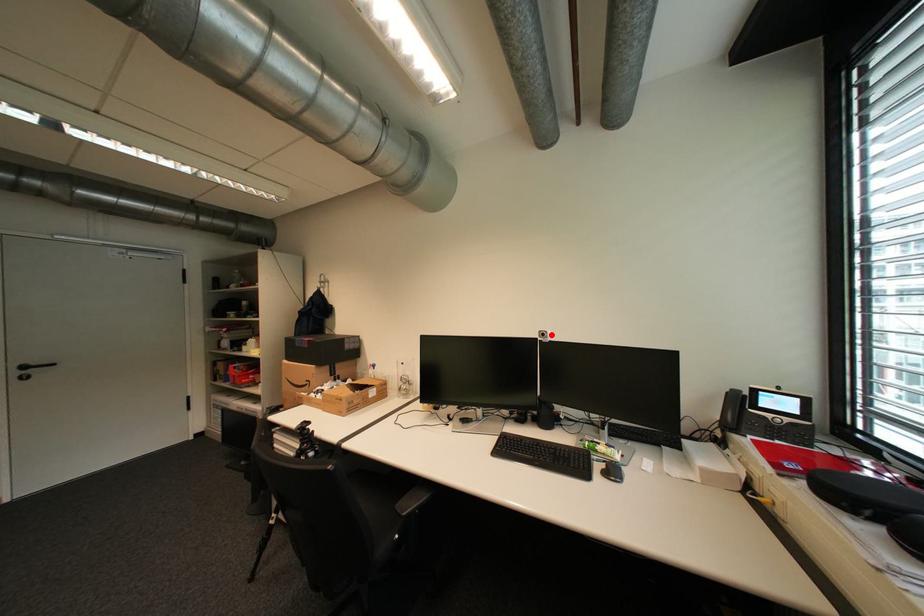
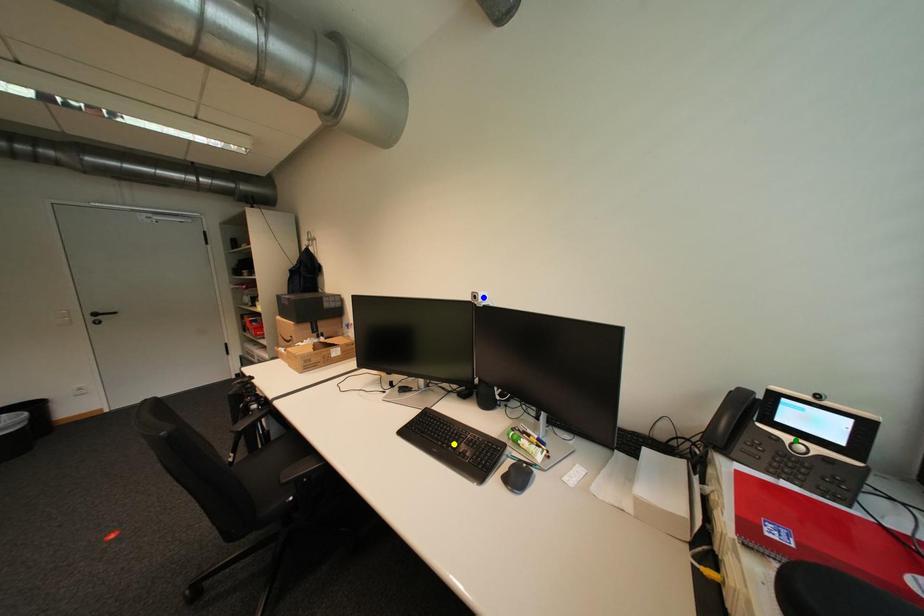
Question: I am providing you with two images of the same scene from different viewpoints. A red point is marked on the first image. You are given multiple points on the second image. Which mark in image 2 goes with the point in image 1?

Choices:
 (A) blue point
 (B) yellow point
 (C) green point

Answer: (A)